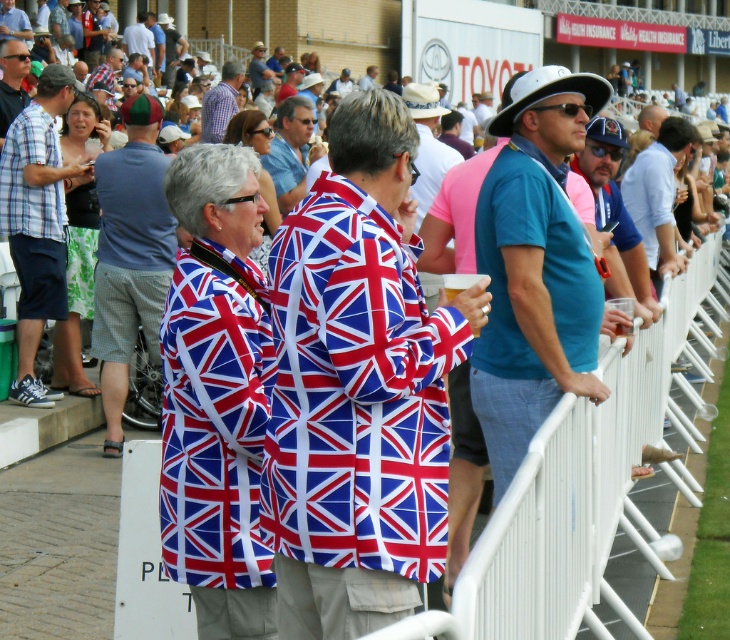
Question: Does union jack shirt at center have a lesser width compared to union jack-patterned shirt at center?

Choices:
 (A) yes
 (B) no

Answer: (B)

Question: Which of the following is the closest to the observer?

Choices:
 (A) union jack-patterned shirt at center
 (B) union jack shirt at center

Answer: (B)

Question: Does union jack shirt at center have a greater width compared to union jack-patterned shirt at center?

Choices:
 (A) no
 (B) yes

Answer: (B)

Question: Considering the relative positions of union jack shirt at center and union jack-patterned shirt at center in the image provided, where is union jack shirt at center located with respect to union jack-patterned shirt at center?

Choices:
 (A) above
 (B) below

Answer: (A)

Question: Which point is closer to the camera?

Choices:
 (A) union jack shirt at center
 (B) union jack-patterned shirt at center

Answer: (A)